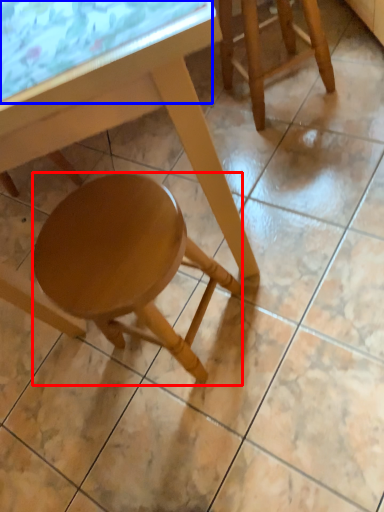
Question: Which object is closer to the camera taking this photo, stool (highlighted by a red box) or glass table (highlighted by a blue box)?

Choices:
 (A) stool
 (B) glass table

Answer: (B)